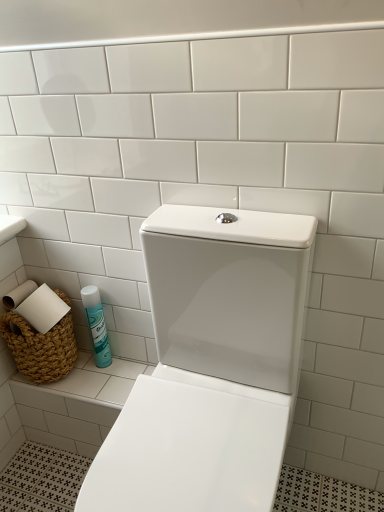
Image resolution: width=384 pixels, height=512 pixels. What do you see at coordinates (96, 326) in the screenshot?
I see `blue glossy can at lower left` at bounding box center [96, 326].

Measure the distance between point (209, 308) and camera.

Point (209, 308) is 98.10 centimeters from camera.

The image size is (384, 512). What do you see at coordinates (40, 347) in the screenshot? I see `braided wicker basket at lower left` at bounding box center [40, 347].

What are the coordinates of `blue glossy can at lower left` in the screenshot? It's located at (96, 326).

Considering the sizes of braided wicker basket at lower left and white glossy toilet at center in the image, is braided wicker basket at lower left bigger or smaller than white glossy toilet at center?

braided wicker basket at lower left is smaller than white glossy toilet at center.

From a real-world perspective, which is physically above, braided wicker basket at lower left or white glossy toilet at center?

From a 3D spatial view, braided wicker basket at lower left is above.

Is braided wicker basket at lower left not near white glossy toilet at center?

That's not correct — braided wicker basket at lower left is a little close to white glossy toilet at center.

Looking at this image, considering the positions of objects braided wicker basket at lower left and white glossy toilet at center in the image provided, who is more to the right, braided wicker basket at lower left or white glossy toilet at center?

From the viewer's perspective, white glossy toilet at center appears more on the right side.

From the image's perspective, which object appears higher, blue glossy can at lower left or braided wicker basket at lower left?

braided wicker basket at lower left appears higher in the image.

Is point (103, 324) more distant than point (43, 348)?

Yes, point (103, 324) is farther from viewer.

In the image, is blue glossy can at lower left on the left side or the right side of braided wicker basket at lower left?

Based on their positions, blue glossy can at lower left is located to the right of braided wicker basket at lower left.

Which is in front, point (176, 468) or point (104, 329)?

The point (176, 468) is in front.

Does white glossy toilet at center have a lesser width compared to blue glossy can at lower left?

No.

How much distance is there between white glossy toilet at center and blue glossy can at lower left?

white glossy toilet at center and blue glossy can at lower left are 18.72 inches apart from each other.

Is white glossy toilet at center far from blue glossy can at lower left?

That's not correct — white glossy toilet at center is a little close to blue glossy can at lower left.

How different are the orientations of white glossy toilet at center and braided wicker basket at lower left in degrees?

The facing directions of white glossy toilet at center and braided wicker basket at lower left are 0.000677 degrees apart.

Is white glossy toilet at center next to braided wicker basket at lower left and touching it?

They are not placed beside each other.

In terms of width, does white glossy toilet at center look wider or thinner when compared to braided wicker basket at lower left?

In the image, white glossy toilet at center appears to be wider than braided wicker basket at lower left.

From a real-world perspective, is white glossy toilet at center under braided wicker basket at lower left?

Indeed, from a real-world perspective, white glossy toilet at center is positioned beneath braided wicker basket at lower left.

Is braided wicker basket at lower left closer to camera compared to blue glossy can at lower left?

Yes, the depth of braided wicker basket at lower left is less than that of blue glossy can at lower left.

From a real-world perspective, who is located lower, braided wicker basket at lower left or blue glossy can at lower left?

In real-world perspective, blue glossy can at lower left is lower.

Are braided wicker basket at lower left and blue glossy can at lower left far apart?

No.

Is braided wicker basket at lower left facing away from blue glossy can at lower left?

No, braided wicker basket at lower left's orientation is not away from blue glossy can at lower left.

Does point (86, 293) lie behind point (206, 499)?

Yes, it is behind point (206, 499).

Is blue glossy can at lower left touching white glossy toilet at center?

They are not placed beside each other.

Can we say blue glossy can at lower left lies outside white glossy toilet at center?

blue glossy can at lower left lies outside white glossy toilet at center's area.

Where is `cleaning product that is under the white glossy toilet at center (from a real-world perspective)`? cleaning product that is under the white glossy toilet at center (from a real-world perspective) is located at coordinates (96, 326).

Identify the location of basket that appears on the left of white glossy toilet at center. (40, 347).

The height and width of the screenshot is (512, 384). Identify the location of cleaning product located on the right of braided wicker basket at lower left. (96, 326).

Which object lies nearer to the anchor point blue glossy can at lower left, white glossy toilet at center or braided wicker basket at lower left?

braided wicker basket at lower left lies closer to blue glossy can at lower left than the other object.

From the image, which object appears to be farther from braided wicker basket at lower left, blue glossy can at lower left or white glossy toilet at center?

white glossy toilet at center lies further to braided wicker basket at lower left than the other object.

Considering their positions, is braided wicker basket at lower left positioned closer to white glossy toilet at center than blue glossy can at lower left?

Among the two, blue glossy can at lower left is located nearer to white glossy toilet at center.

Considering their positions, is white glossy toilet at center positioned further to braided wicker basket at lower left than blue glossy can at lower left?

Among the two, white glossy toilet at center is located further to braided wicker basket at lower left.

Which object lies nearer to the anchor point blue glossy can at lower left, braided wicker basket at lower left or white glossy toilet at center?

The object closer to blue glossy can at lower left is braided wicker basket at lower left.

Estimate the real-world distances between objects in this image. Which object is closer to white glossy toilet at center, blue glossy can at lower left or braided wicker basket at lower left?

blue glossy can at lower left is closer to white glossy toilet at center.

Image resolution: width=384 pixels, height=512 pixels. I want to click on basket between white glossy toilet at center and blue glossy can at lower left in the front-back direction, so tap(40, 347).